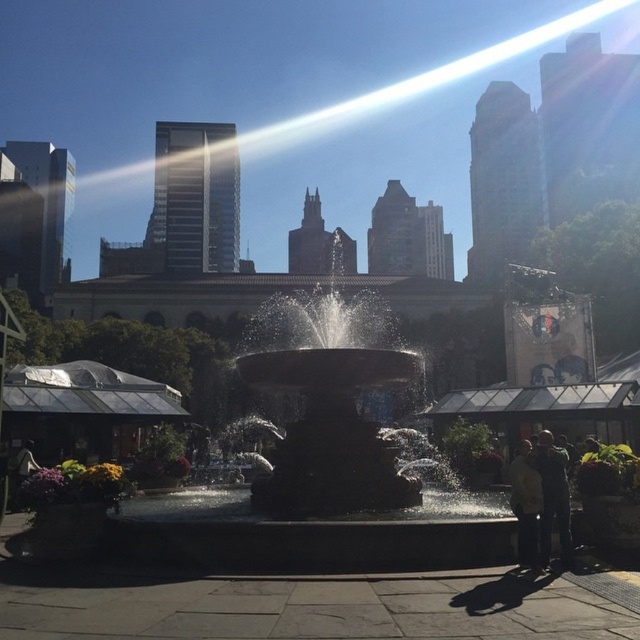
Who is shorter, dark gray jacket at lower right or light beige jacket at lower right?

dark gray jacket at lower right is shorter.

Between dark gray jacket at lower right and light beige jacket at lower right, which one is positioned higher?

dark gray jacket at lower right

This screenshot has height=640, width=640. What are the coordinates of `dark gray jacket at lower right` in the screenshot? It's located at (552, 497).

The width and height of the screenshot is (640, 640). Find the location of `dark gray jacket at lower right`. dark gray jacket at lower right is located at coordinates (552, 497).

Locate an element on the screen. dark gray stone fountain at center is located at coordinates (332, 433).

The width and height of the screenshot is (640, 640). Identify the location of dark gray stone fountain at center. (332, 433).

From the picture: Does dark gray stone fountain at center come in front of dark gray jacket at lower right?

No.

Which is in front, point (408, 493) or point (541, 540)?

Point (541, 540)

Does point (276, 504) come in front of point (554, 456)?

That is False.

Where is `dark gray stone fountain at center`? Image resolution: width=640 pixels, height=640 pixels. dark gray stone fountain at center is located at coordinates point(332,433).